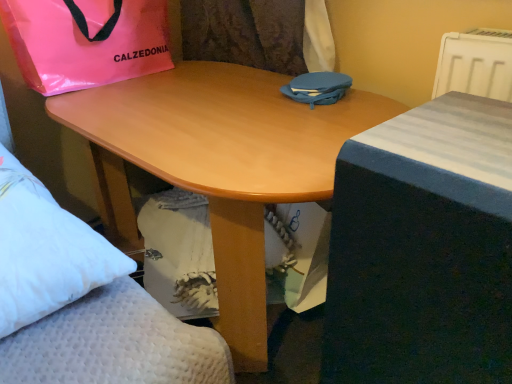
Question: From a real-world perspective, relative to pink plastic bag at upper left, placed as the second bag when sorted from right to left, is blue fabric bag at center, acting as the 2th bag starting from the left, vertically above or below?

Choices:
 (A) below
 (B) above

Answer: (A)

Question: From the image's perspective, is blue fabric bag at center, acting as the 2th bag starting from the left, located above or below pink plastic bag at upper left, placed as the second bag when sorted from right to left?

Choices:
 (A) below
 (B) above

Answer: (A)

Question: Which of these objects is positioned closest to the blue fabric bag at center, placed as the 1th bag when sorted from right to left?

Choices:
 (A) white plastic radiator at upper right
 (B) light wood desk at center
 (C) blue fabric bed at right
 (D) pink plastic bag at upper left, placed as the second bag when sorted from right to left

Answer: (B)

Question: Estimate the real-world distances between objects in this image. Which object is closer to the white plastic radiator at upper right?

Choices:
 (A) light wood desk at center
 (B) blue fabric bed at right
 (C) pink plastic bag at upper left, placed as the second bag when sorted from right to left
 (D) blue fabric bag at center, placed as the 1th bag when sorted from right to left

Answer: (D)